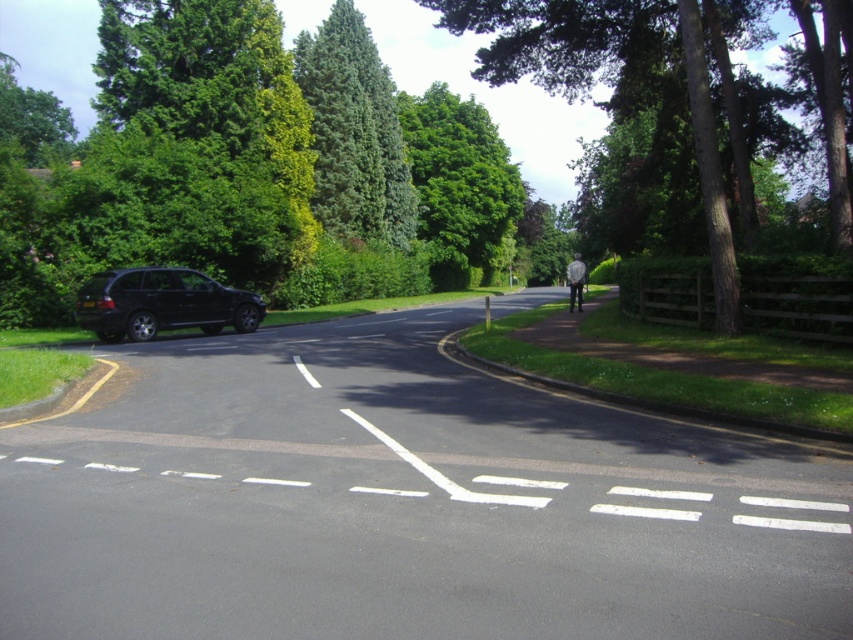
Question: Which of the following is the farthest from the observer?

Choices:
 (A) (462, 29)
 (B) (511, 204)
 (C) (126, 371)
 (D) (341, 104)

Answer: (B)

Question: Estimate the real-world distances between objects in this image. Which object is closer to the green coniferous tree at upper center?

Choices:
 (A) green leafy tree at center
 (B) green leafy tree at upper center

Answer: (B)

Question: Which object is the farthest from the green leafy tree at upper center?

Choices:
 (A) green leafy tree at center
 (B) shiny black suv at left
 (C) black car at left

Answer: (C)

Question: Does black car at left have a lesser width compared to green leafy tree at center?

Choices:
 (A) no
 (B) yes

Answer: (A)

Question: Does black car at left appear under green leafy tree at upper center?

Choices:
 (A) no
 (B) yes

Answer: (B)

Question: Does black car at left have a lesser width compared to green leafy tree at upper center?

Choices:
 (A) yes
 (B) no

Answer: (B)